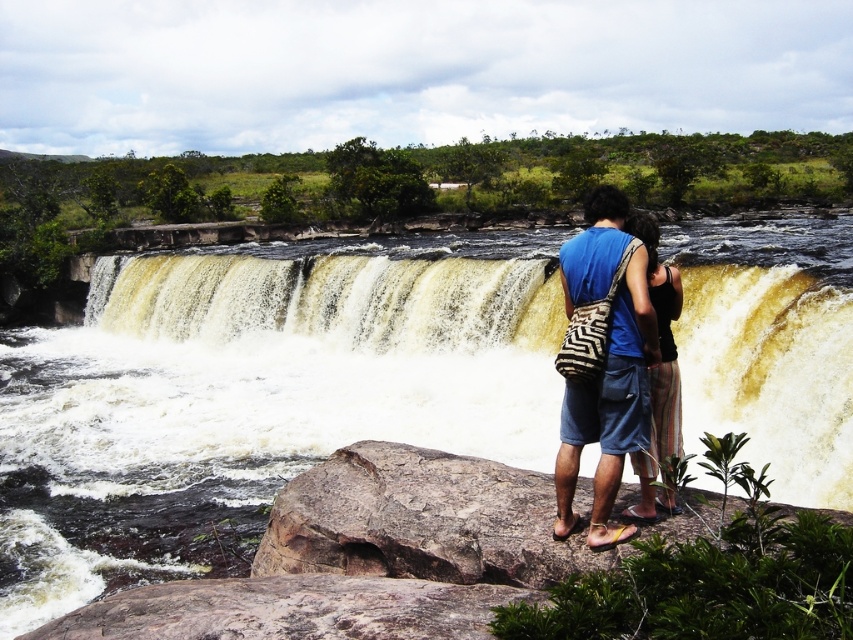
Question: Which object appears closest to the camera in this image?

Choices:
 (A) striped cotton skirt at center
 (B) brown textured water at center
 (C) blue cotton shirt at center

Answer: (A)

Question: Can you confirm if brown textured water at center is bigger than blue cotton shirt at center?

Choices:
 (A) no
 (B) yes

Answer: (B)

Question: Among these points, which one is farthest from the camera?

Choices:
 (A) (364, 540)
 (B) (62, 346)
 (C) (660, 376)

Answer: (B)

Question: Which point is farther to the camera?

Choices:
 (A) (434, 388)
 (B) (519, 563)

Answer: (A)

Question: Is brown rough rock at center wider than blue cotton shirt at center?

Choices:
 (A) yes
 (B) no

Answer: (B)

Question: Does blue cotton shirt at center have a lesser width compared to striped cotton skirt at center?

Choices:
 (A) no
 (B) yes

Answer: (A)